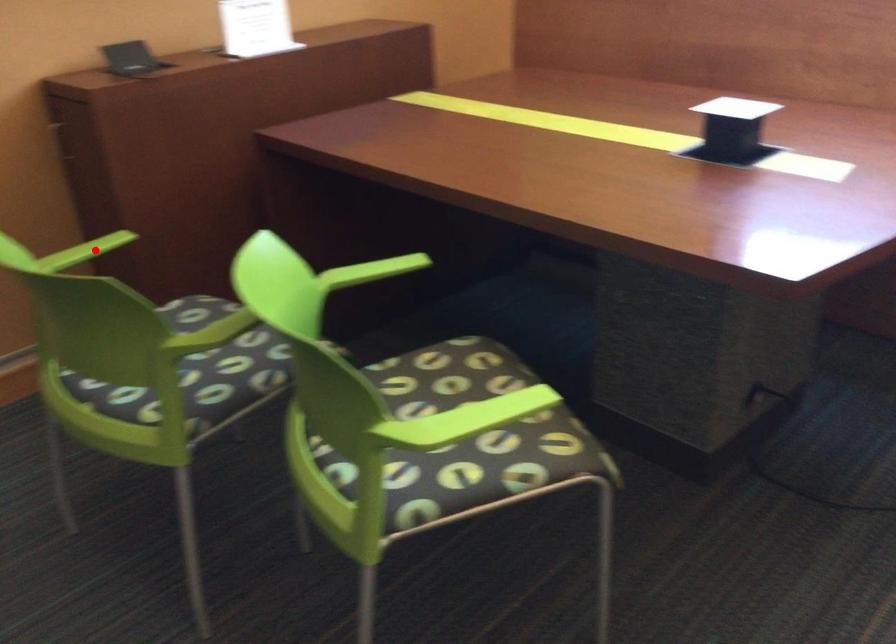
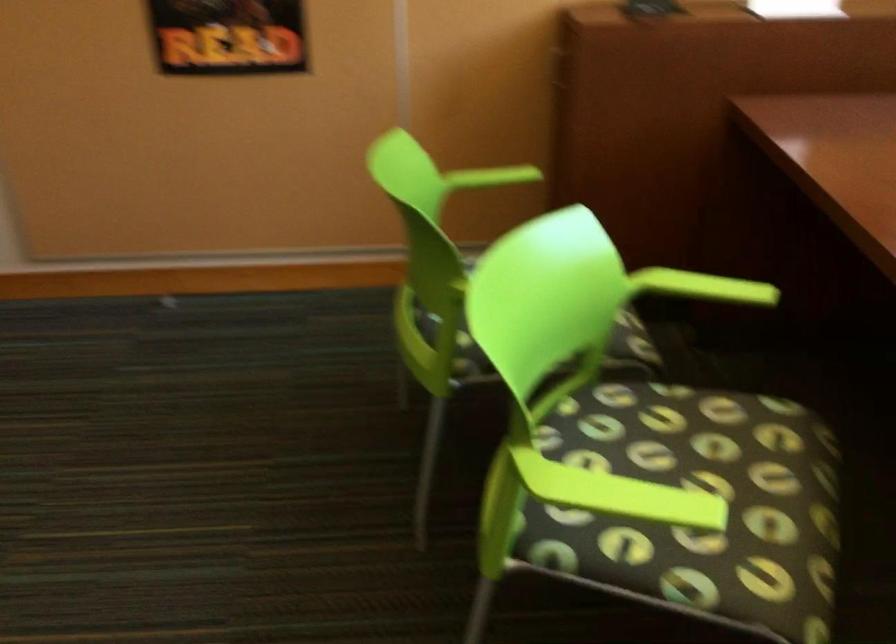
Where in the second image is the point corresponding to the highlighted location from the first image?

(497, 176)